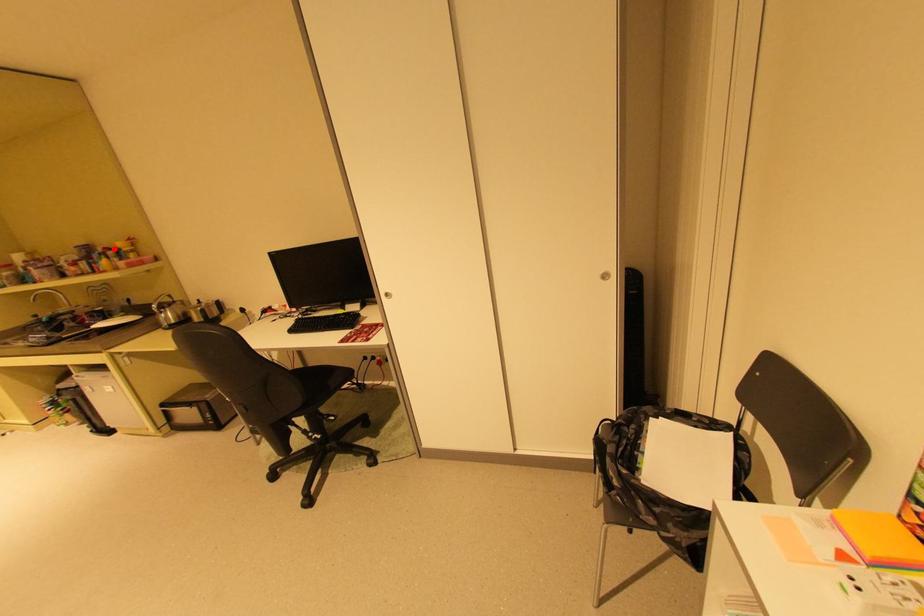
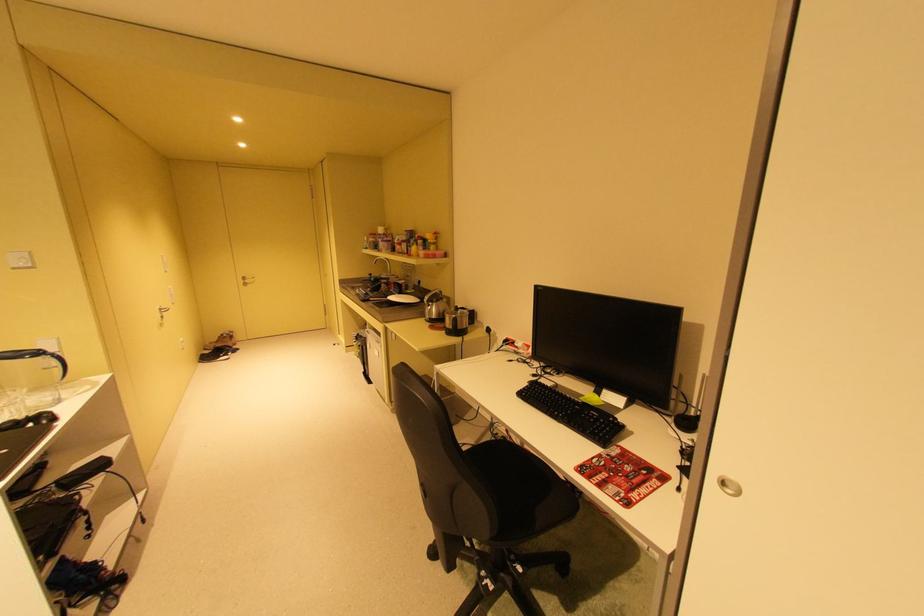
Question: I am providing you with two images of the same scene from different viewpoints. Given a red point in image1, look at the same physical point in image2. Is it:

Choices:
 (A) Closer to the viewpoint
 (B) Farther from the viewpoint

Answer: (A)